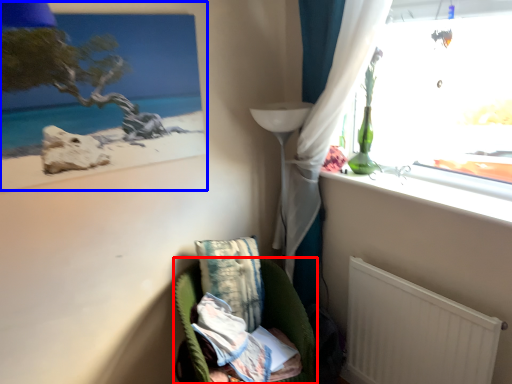
Question: Which object appears farthest to the camera in this image, furniture (highlighted by a red box) or picture frame (highlighted by a blue box)?

Choices:
 (A) furniture
 (B) picture frame

Answer: (A)